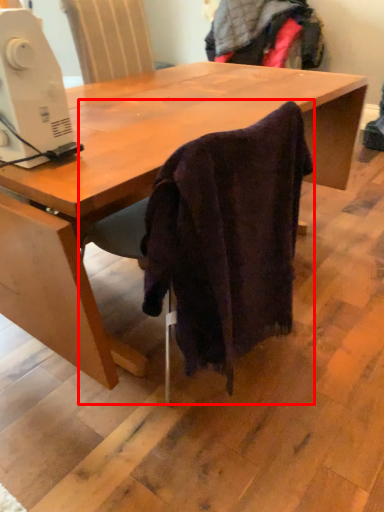
Question: From the image's perspective, what is the correct spatial relationship of chair (annotated by the red box) in relation to sewing machine?

Choices:
 (A) below
 (B) above

Answer: (A)